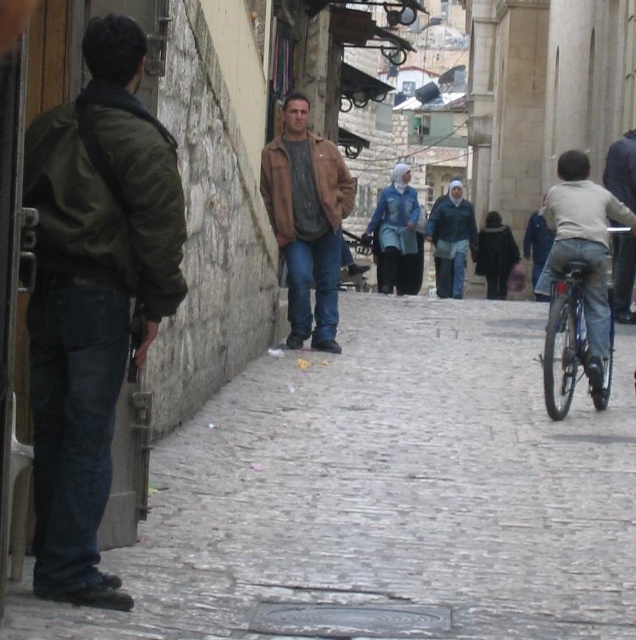
You are a delivery robot with a 1.2 meter wide package. You need to navigate from the cobblestone pavement at lower left to the brown leather jacket at center. Is there enough space between them for your package?

The distance between the cobblestone pavement at lower left and the brown leather jacket at center is 4.95 meters. Since your package is 1.2 meters wide, there is sufficient space as 4.95 meters is greater than 1.2 meters.

There is a cobblestone pavement at lower left and a man in a dark green jacket and jeans. How far apart are they?

The cobblestone pavement at lower left and the man in a dark green jacket and jeans are 11.49 meters apart.